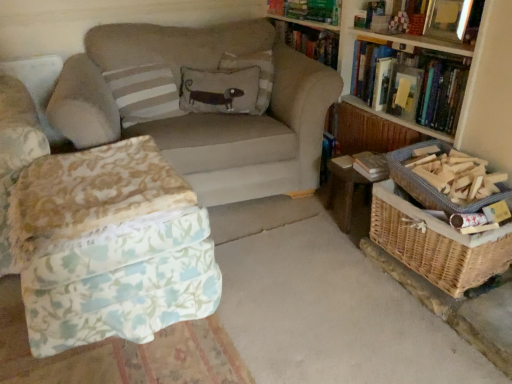
Question: Can you confirm if woven brown basket at right, the 1th basket when ordered from top to bottom, is smaller than woven wood table at lower right?

Choices:
 (A) no
 (B) yes

Answer: (B)

Question: Is the depth of woven brown basket at right, the 2th basket ordered from the bottom, greater than that of woven wood table at lower right?

Choices:
 (A) yes
 (B) no

Answer: (B)

Question: Considering the relative sizes of woven brown basket at right, the 1th basket when ordered from top to bottom, and woven wood table at lower right in the image provided, is woven brown basket at right, the 1th basket when ordered from top to bottom, taller than woven wood table at lower right?

Choices:
 (A) no
 (B) yes

Answer: (A)

Question: From a real-world perspective, does woven brown basket at right, the 2th basket ordered from the bottom, stand above woven wood table at lower right?

Choices:
 (A) no
 (B) yes

Answer: (B)

Question: Can you confirm if woven brown basket at right, the 2th basket ordered from the bottom, is bigger than woven wood table at lower right?

Choices:
 (A) yes
 (B) no

Answer: (B)

Question: From a real-world perspective, is floral fabric ottoman at lower left physically located above or below beige fabric couch at center?

Choices:
 (A) below
 (B) above

Answer: (A)

Question: Does point (201, 289) appear closer or farther from the camera than point (159, 44)?

Choices:
 (A) closer
 (B) farther

Answer: (A)

Question: Considering the positions of floral fabric ottoman at lower left and beige fabric couch at center in the image, is floral fabric ottoman at lower left taller or shorter than beige fabric couch at center?

Choices:
 (A) short
 (B) tall

Answer: (A)

Question: In the image, is floral fabric ottoman at lower left positioned in front of or behind beige fabric couch at center?

Choices:
 (A) behind
 (B) front

Answer: (B)

Question: In terms of height, does hardcover book at upper center, which is counted as the first book, starting from the top, look taller or shorter compared to woven wood table at lower right?

Choices:
 (A) short
 (B) tall

Answer: (A)

Question: From a real-world perspective, is hardcover book at upper center, which ranks as the 3th book in bottom-to-top order, above or below woven wood table at lower right?

Choices:
 (A) above
 (B) below

Answer: (A)

Question: Would you say hardcover book at upper center, which ranks as the 3th book in bottom-to-top order, is to the left or to the right of woven wood table at lower right in the picture?

Choices:
 (A) left
 (B) right

Answer: (A)

Question: In the image, is hardcover book at upper center, which is counted as the first book, starting from the top, positioned in front of or behind woven wood table at lower right?

Choices:
 (A) behind
 (B) front

Answer: (A)

Question: Considering the positions of hardcover book at upper center, which ranks as the 3th book in bottom-to-top order, and beige fabric couch at center in the image, is hardcover book at upper center, which ranks as the 3th book in bottom-to-top order, taller or shorter than beige fabric couch at center?

Choices:
 (A) short
 (B) tall

Answer: (A)

Question: Would you say hardcover book at upper center, which ranks as the 3th book in bottom-to-top order, is to the left or to the right of beige fabric couch at center in the picture?

Choices:
 (A) right
 (B) left

Answer: (A)